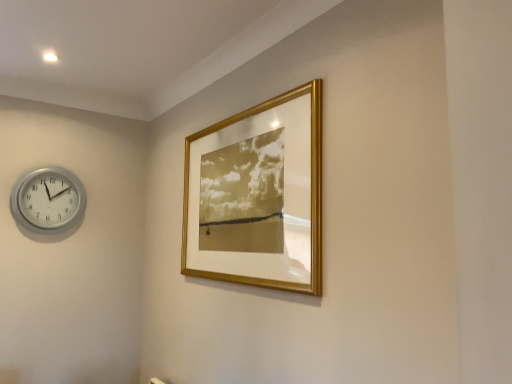
Image resolution: width=512 pixels, height=384 pixels. Describe the element at coordinates (48, 199) in the screenshot. I see `silver metallic wall clock at left` at that location.

Locate an element on the screen. This screenshot has height=384, width=512. silver metallic wall clock at left is located at coordinates (48, 199).

In order to face silver metallic wall clock at left, should I rotate leftwards or rightwards?

Rotate left and turn 25.714 degrees.

Measure the distance between point (312, 137) and camera.

The depth of point (312, 137) is 1.51 meters.

Describe the element at coordinates (257, 195) in the screenshot. I see `gold metallic picture frame at upper center` at that location.

The image size is (512, 384). In order to click on gold metallic picture frame at upper center in this screenshot , I will do `click(257, 195)`.

I want to click on silver metallic wall clock at left, so click(x=48, y=199).

Considering the positions of objects silver metallic wall clock at left and gold metallic picture frame at upper center in the image provided, who is more to the right, silver metallic wall clock at left or gold metallic picture frame at upper center?

gold metallic picture frame at upper center is more to the right.

Is the depth of silver metallic wall clock at left greater than that of gold metallic picture frame at upper center?

Yes.

Considering the positions of points (39, 211) and (295, 267), is point (39, 211) closer to camera compared to point (295, 267)?

No, it is not.

From the picture: From the image's perspective, is silver metallic wall clock at left under gold metallic picture frame at upper center?

Correct, silver metallic wall clock at left appears lower than gold metallic picture frame at upper center in the image.

From a real-world perspective, who is located lower, silver metallic wall clock at left or gold metallic picture frame at upper center?

From a 3D spatial view, gold metallic picture frame at upper center is below.

Considering the sizes of silver metallic wall clock at left and gold metallic picture frame at upper center in the image, is silver metallic wall clock at left wider or thinner than gold metallic picture frame at upper center?

In the image, silver metallic wall clock at left appears to be wider than gold metallic picture frame at upper center.

From the picture: Considering the sizes of objects silver metallic wall clock at left and gold metallic picture frame at upper center in the image provided, who is taller, silver metallic wall clock at left or gold metallic picture frame at upper center?

Standing taller between the two is gold metallic picture frame at upper center.

In terms of size, does silver metallic wall clock at left appear bigger or smaller than gold metallic picture frame at upper center?

Considering their sizes, silver metallic wall clock at left takes up less space than gold metallic picture frame at upper center.

From the picture: Is silver metallic wall clock at left surrounding gold metallic picture frame at upper center?

No, gold metallic picture frame at upper center is located outside of silver metallic wall clock at left.

Would you say silver metallic wall clock at left is a long distance from gold metallic picture frame at upper center?

That's right, there is a large distance between silver metallic wall clock at left and gold metallic picture frame at upper center.

Is silver metallic wall clock at left oriented towards gold metallic picture frame at upper center?

Yes, silver metallic wall clock at left is aimed at gold metallic picture frame at upper center.

What's the angular difference between silver metallic wall clock at left and gold metallic picture frame at upper center's facing directions?

The facing directions of silver metallic wall clock at left and gold metallic picture frame at upper center are 90 degrees apart.

Based on the photo, how much distance is there between silver metallic wall clock at left and gold metallic picture frame at upper center?

silver metallic wall clock at left is 3.88 feet from gold metallic picture frame at upper center.

Where is `picture frame directly beneath the silver metallic wall clock at left (from a real-world perspective)`? Image resolution: width=512 pixels, height=384 pixels. picture frame directly beneath the silver metallic wall clock at left (from a real-world perspective) is located at coordinates (257, 195).

Which object is positioned more to the right, gold metallic picture frame at upper center or silver metallic wall clock at left?

gold metallic picture frame at upper center is more to the right.

Which object is further away from the camera taking this photo, gold metallic picture frame at upper center or silver metallic wall clock at left?

silver metallic wall clock at left.

Does point (205, 186) come behind point (23, 217)?

No, (205, 186) is closer to viewer.

From the image's perspective, would you say gold metallic picture frame at upper center is shown under silver metallic wall clock at left?

Actually, gold metallic picture frame at upper center appears above silver metallic wall clock at left in the image.

From a real-world perspective, which object rests below the other?

gold metallic picture frame at upper center, from a real-world perspective.

Which object is wider, gold metallic picture frame at upper center or silver metallic wall clock at left?

Wider between the two is silver metallic wall clock at left.

Can you confirm if gold metallic picture frame at upper center is shorter than silver metallic wall clock at left?

No.

Can you confirm if gold metallic picture frame at upper center is bigger than silver metallic wall clock at left?

Yes, gold metallic picture frame at upper center is bigger than silver metallic wall clock at left.

Is gold metallic picture frame at upper center not inside silver metallic wall clock at left?

Yes, gold metallic picture frame at upper center is located beyond the bounds of silver metallic wall clock at left.

Is gold metallic picture frame at upper center directly adjacent to silver metallic wall clock at left?

gold metallic picture frame at upper center and silver metallic wall clock at left are clearly separated.

Is gold metallic picture frame at upper center looking in the opposite direction of silver metallic wall clock at left?

No, gold metallic picture frame at upper center's orientation is not away from silver metallic wall clock at left.

How many degrees apart are the facing directions of gold metallic picture frame at upper center and silver metallic wall clock at left?

The angular difference between gold metallic picture frame at upper center and silver metallic wall clock at left is 90 degrees.

Measure the distance between gold metallic picture frame at upper center and silver metallic wall clock at left.

1.18 meters.

Locate an element on the screen. picture frame below the silver metallic wall clock at left (from a real-world perspective) is located at coordinates (257, 195).

The width and height of the screenshot is (512, 384). I want to click on wall clock behind the gold metallic picture frame at upper center, so 48,199.

Find the location of `picture frame that appears on the right of silver metallic wall clock at left`. picture frame that appears on the right of silver metallic wall clock at left is located at coordinates (257, 195).